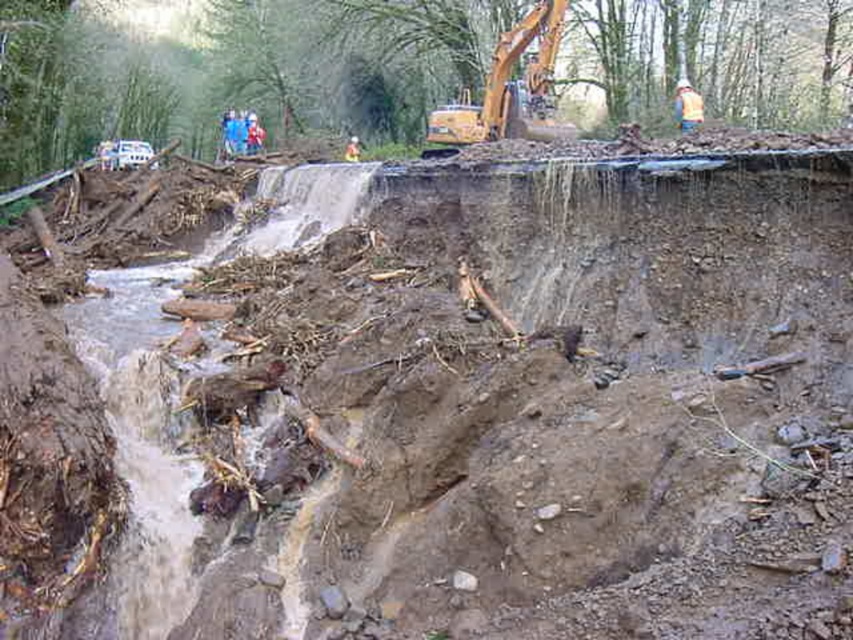
Which is below, yellow metallic excavator at upper center or yellow reflective vest at upper center?

yellow reflective vest at upper center

Is yellow metallic excavator at upper center closer to the viewer compared to yellow reflective vest at upper center?

Yes, it is in front of yellow reflective vest at upper center.

Is point (547, 33) farther from viewer compared to point (686, 122)?

That is False.

Where is `yellow metallic excavator at upper center`? This screenshot has height=640, width=853. yellow metallic excavator at upper center is located at coordinates (509, 86).